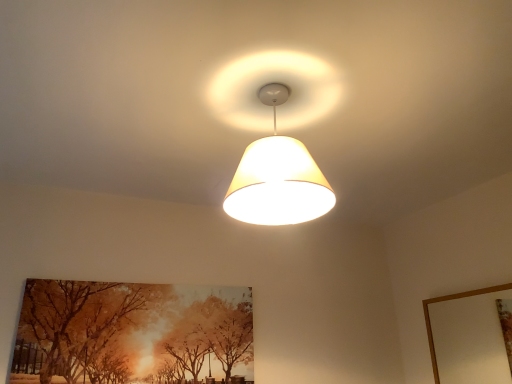
Question: Can you confirm if wooden picture frame at upper right is bigger than orange painted canvas at lower left?

Choices:
 (A) no
 (B) yes

Answer: (A)

Question: Is wooden picture frame at upper right not inside orange painted canvas at lower left?

Choices:
 (A) no
 (B) yes

Answer: (B)

Question: Considering the relative sizes of wooden picture frame at upper right and orange painted canvas at lower left in the image provided, is wooden picture frame at upper right taller than orange painted canvas at lower left?

Choices:
 (A) yes
 (B) no

Answer: (B)

Question: Is wooden picture frame at upper right further to the viewer compared to orange painted canvas at lower left?

Choices:
 (A) yes
 (B) no

Answer: (B)

Question: Is wooden picture frame at upper right thinner than orange painted canvas at lower left?

Choices:
 (A) yes
 (B) no

Answer: (B)

Question: In terms of size, does orange painted canvas at lower left appear bigger or smaller than matte white lampshade at center?

Choices:
 (A) small
 (B) big

Answer: (A)

Question: Considering the positions of point (122, 326) and point (245, 215), is point (122, 326) closer or farther from the camera than point (245, 215)?

Choices:
 (A) farther
 (B) closer

Answer: (A)

Question: Considering the positions of orange painted canvas at lower left and matte white lampshade at center in the image, is orange painted canvas at lower left taller or shorter than matte white lampshade at center?

Choices:
 (A) short
 (B) tall

Answer: (B)

Question: Visually, is orange painted canvas at lower left positioned to the left or to the right of matte white lampshade at center?

Choices:
 (A) right
 (B) left

Answer: (B)

Question: Looking at their shapes, would you say wooden picture frame at upper right is wider or thinner than matte white lampshade at center?

Choices:
 (A) wide
 (B) thin

Answer: (B)

Question: Is wooden picture frame at upper right situated inside matte white lampshade at center or outside?

Choices:
 (A) outside
 (B) inside

Answer: (A)

Question: Is wooden picture frame at upper right taller or shorter than matte white lampshade at center?

Choices:
 (A) tall
 (B) short

Answer: (A)

Question: Visually, is wooden picture frame at upper right positioned to the left or to the right of matte white lampshade at center?

Choices:
 (A) right
 (B) left

Answer: (A)

Question: In terms of height, does wooden picture frame at upper right look taller or shorter compared to orange painted canvas at lower left?

Choices:
 (A) tall
 (B) short

Answer: (B)

Question: Based on their positions, is wooden picture frame at upper right located to the left or right of orange painted canvas at lower left?

Choices:
 (A) right
 (B) left

Answer: (A)